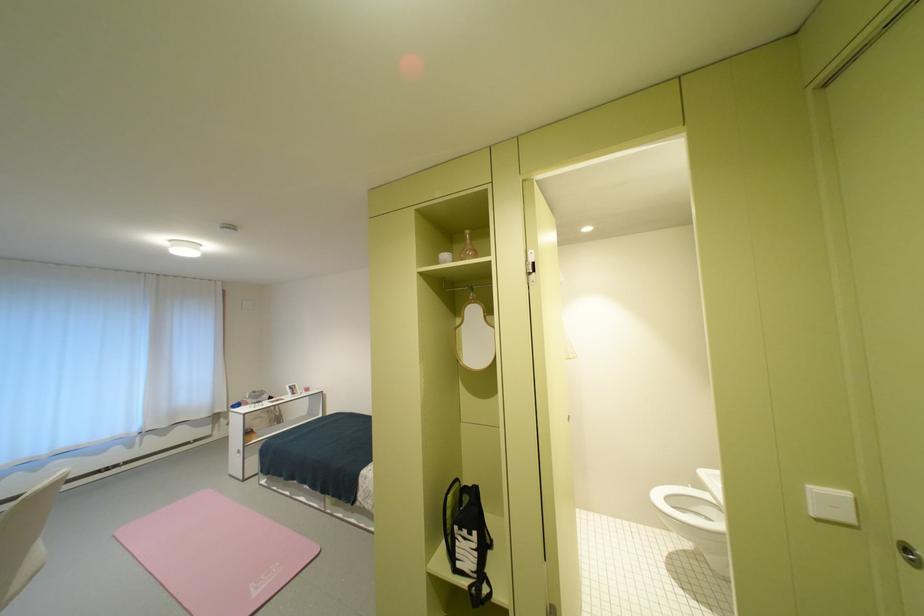
Locate an element on the screen. The image size is (924, 616). hanging mirror is located at coordinates (473, 338).